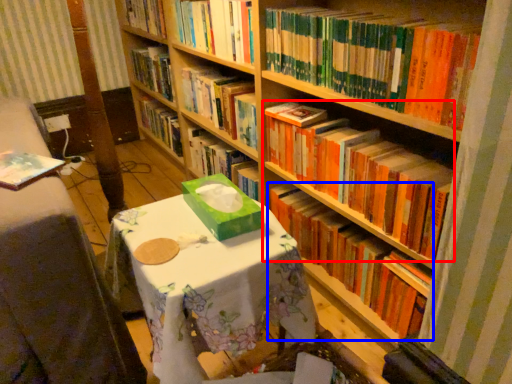
Question: Which object appears farthest to the camera in this image, book (highlighted by a red box) or book (highlighted by a blue box)?

Choices:
 (A) book
 (B) book

Answer: (B)